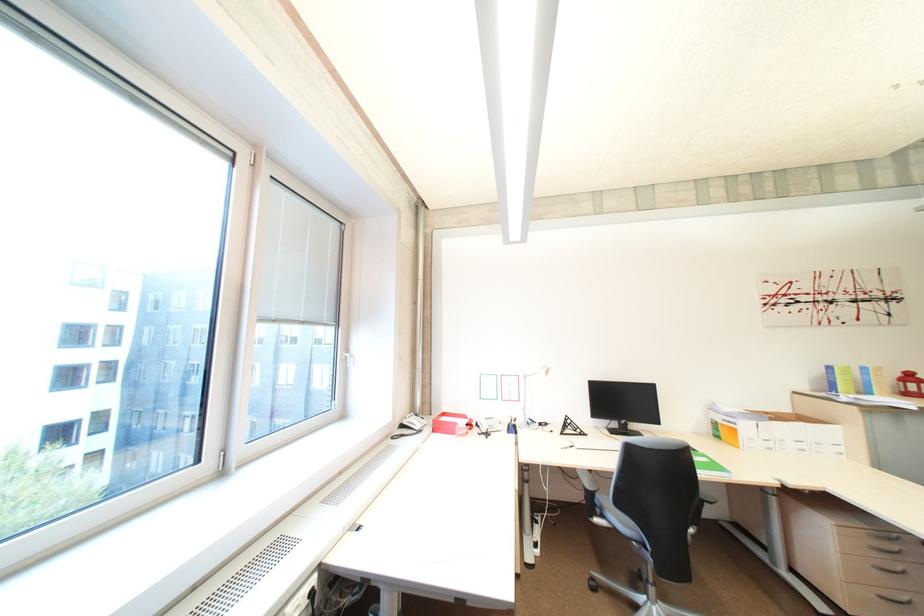
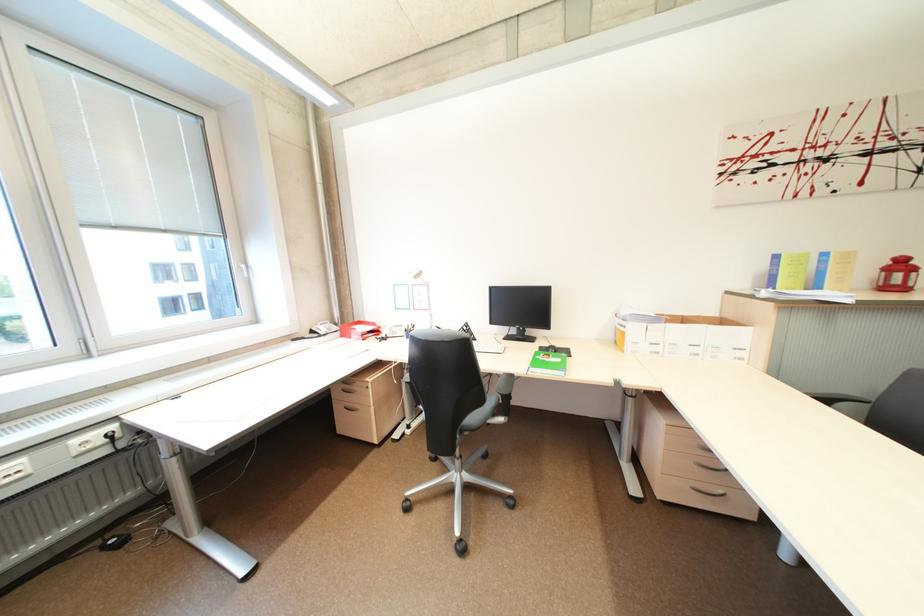
In the second image, find the point that corresponds to the point at 878,392 in the first image.

(825, 286)